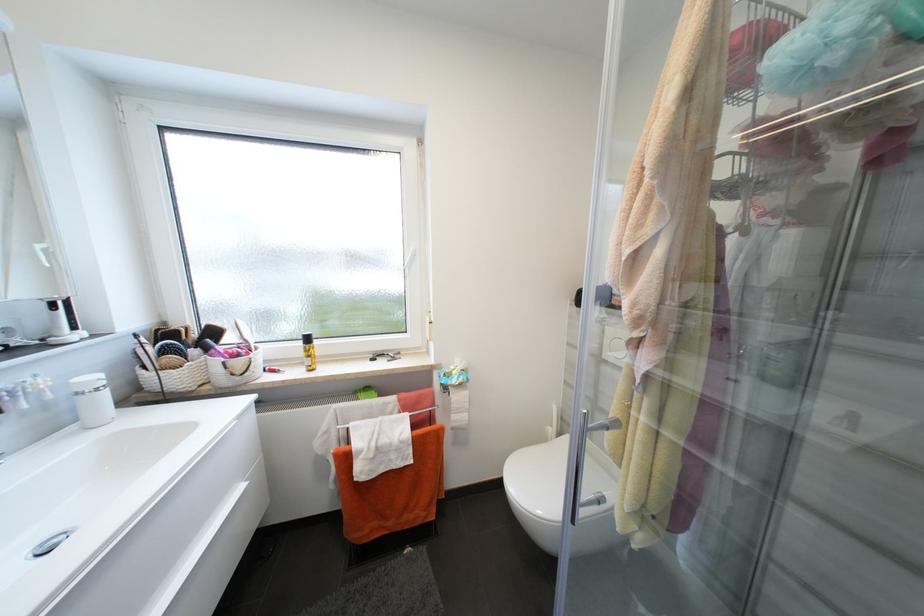
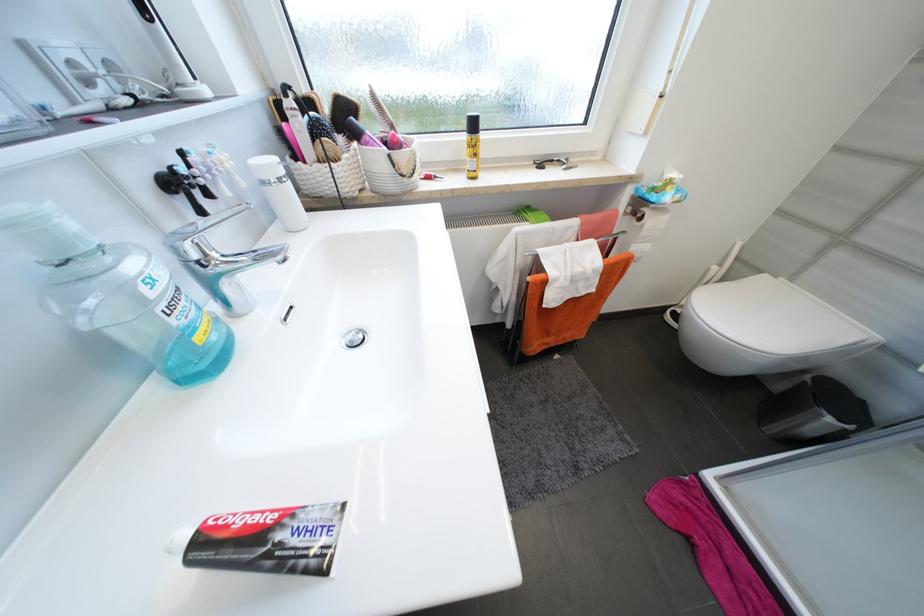
Find the pixel in the second image that matches pixel 213 350 in the first image.

(362, 136)